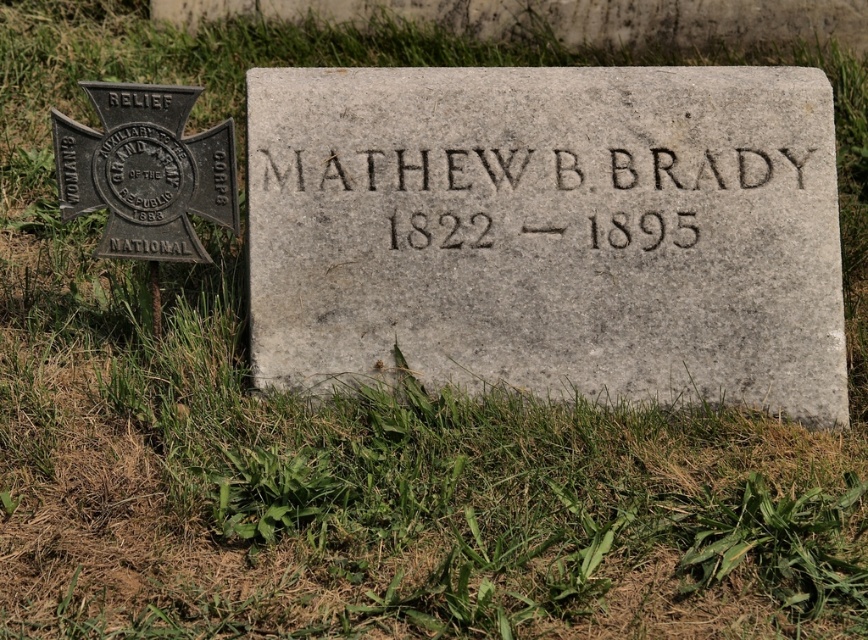
You are standing in front of the gravestone of Mathew B. Brady. You notice two points marked on the image. The first point is at coordinates point (x=559, y=244) and the second point is at coordinates point (x=692, y=216). Which of these points is closer to you?

Point (x=559, y=244) is closer to the camera than point (x=692, y=216), so the first point is closer to you.

What is the significance of the point at coordinates (525, 172) in the image?

The point at coordinates (525, 172) marks the location of the black stone engraving at center.